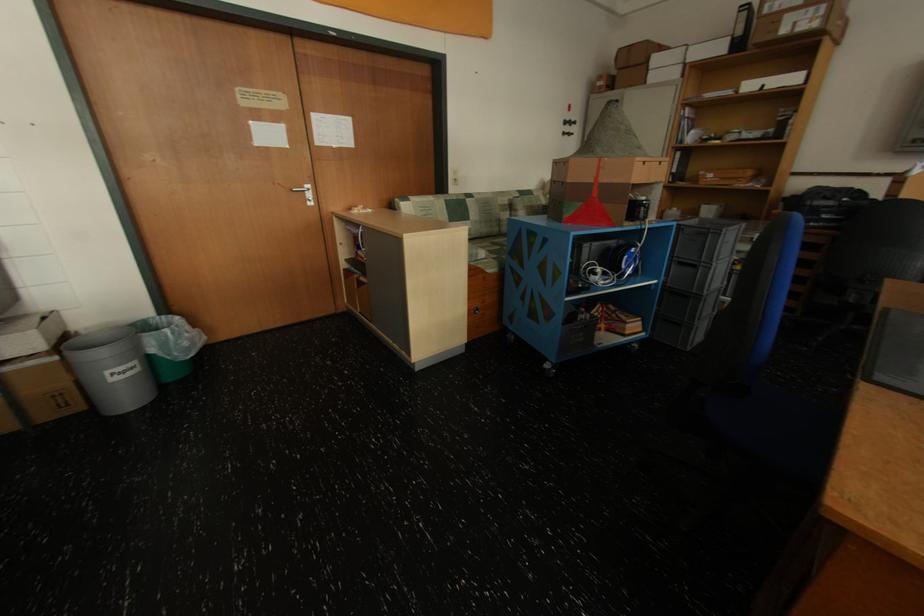
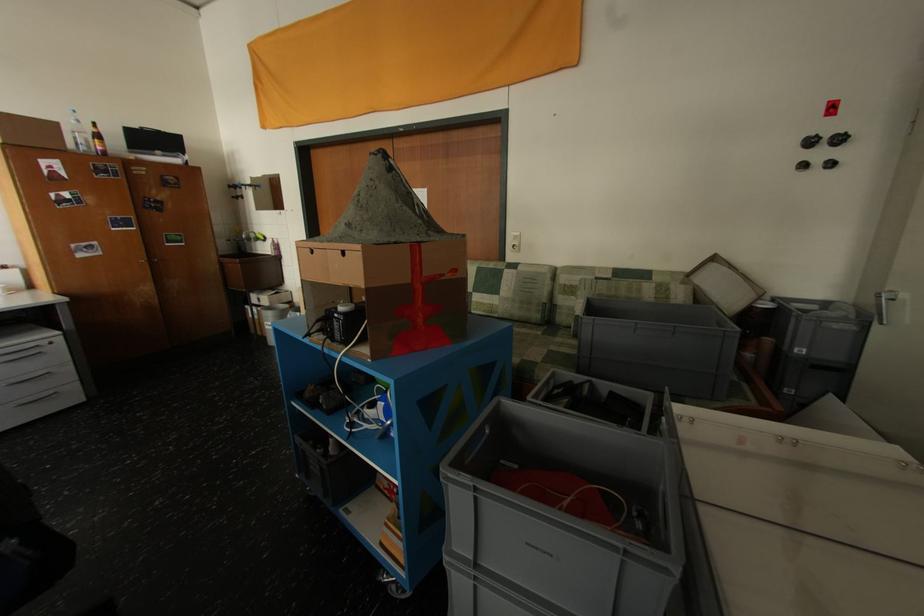
The point at (577, 121) is marked in the first image. Where is the corresponding point in the second image?

(821, 137)